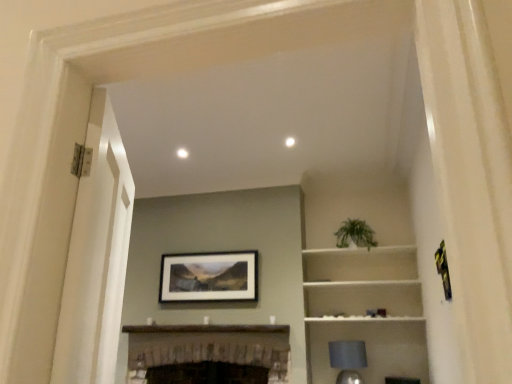
Question: Is point coord(314,292) positioned closer to the camera than point coord(210,263)?

Choices:
 (A) closer
 (B) farther

Answer: (A)

Question: In terms of height, does white matte cabinet at upper right look taller or shorter compared to matte black picture frame at center?

Choices:
 (A) short
 (B) tall

Answer: (B)

Question: Which is farther from the dark brown wood fireplace at center?

Choices:
 (A) green leafy plant at upper center
 (B) matte black picture frame at center
 (C) white matte cabinet at upper right
 (D) white glossy door at left
 (E) matte gray lampshade at lower right

Answer: (D)

Question: Which is nearer to the matte gray lampshade at lower right?

Choices:
 (A) dark brown wood fireplace at center
 (B) white matte cabinet at upper right
 (C) matte black picture frame at center
 (D) green leafy plant at upper center
 (E) white glossy door at left

Answer: (B)